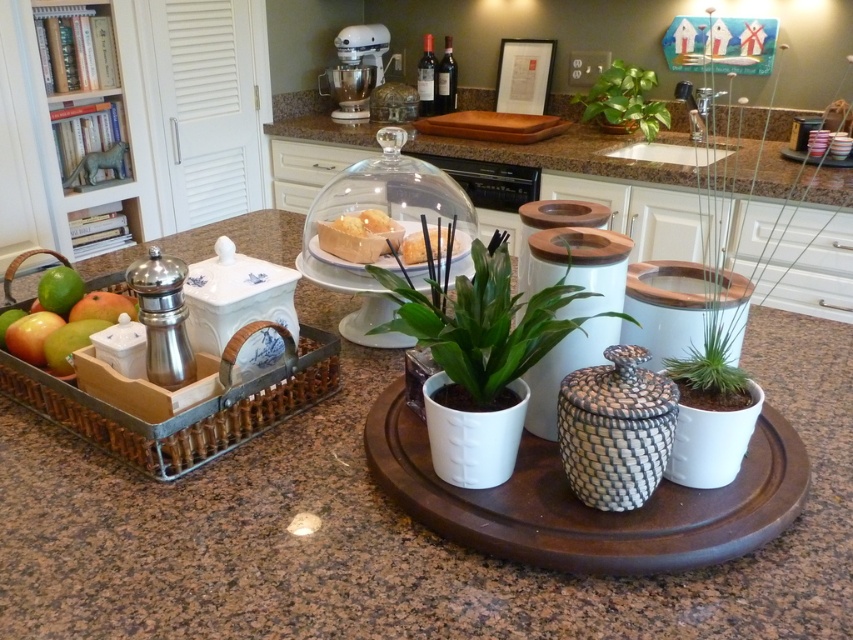
You are arranging items on a kitchen countertop and want to place a new item between the wooden tray at left and the yellow sponge cake at center. Based on their positions, where should you place the new item?

The wooden tray at left is in front of the yellow sponge cake at center, so you should place the new item between them in the space between the wooden tray at left and the yellow sponge cake at center.

You are arranging flowers in the kitchen and need to place a vase between the wooden tray at left and the green matte plant at center. The vase is 10 inches wide. Will there be enough space between them to fit the vase?

The wooden tray at left is 12.85 inches from the green matte plant at center. Since the vase is 10 inches wide, there is enough space between them to fit the vase.

You are a chef preparing to place a new dessert on the kitchen countertop. You have a wooden tray at left and a yellow sponge cake at center. Which object has a greater width?

The wooden tray at left has a greater width than the yellow sponge cake at center.